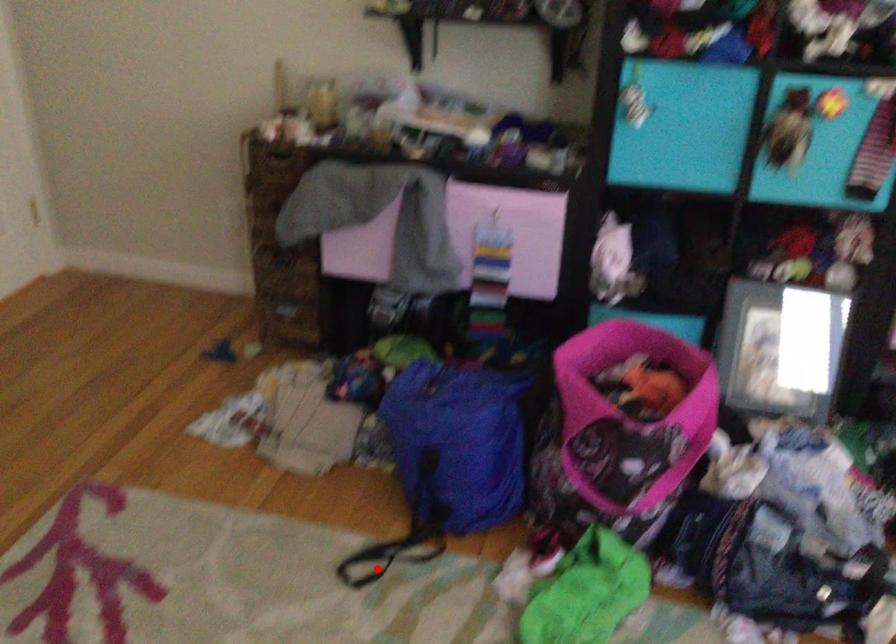
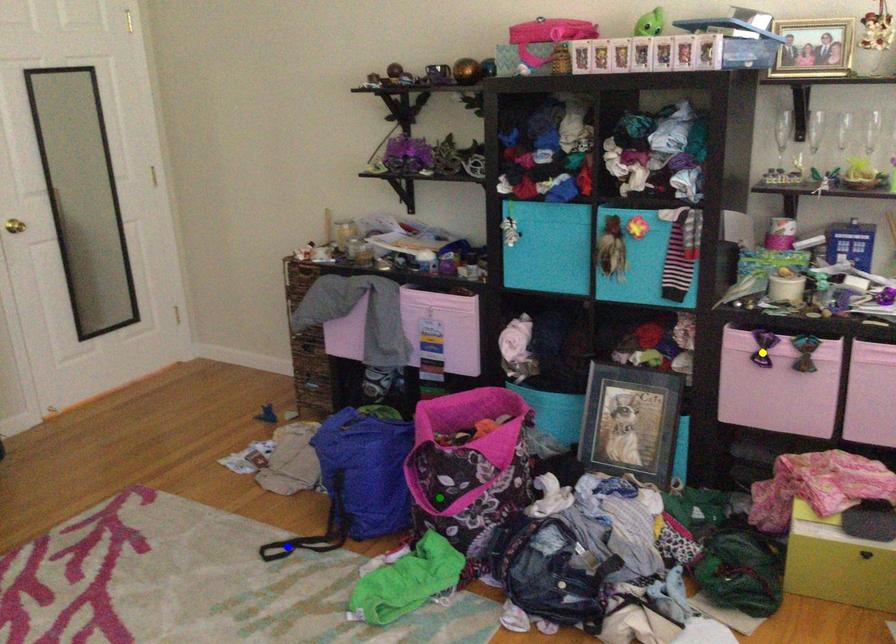
Question: I am providing you with two images of the same scene from different viewpoints. A red point is marked on the first image. You are given multiple points on the second image. Which spot in image 2 lines up with the point in image 1?

Choices:
 (A) yellow point
 (B) green point
 (C) blue point

Answer: (C)